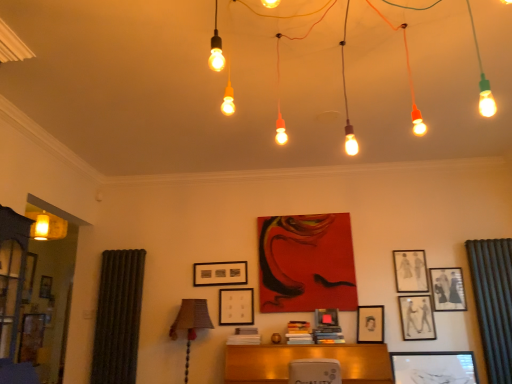
Question: From a real-world perspective, is matte black picture frame at center, the 5th picture frame when ordered from right to left, physically located above or below green textured curtain at right?

Choices:
 (A) above
 (B) below

Answer: (B)

Question: Considering the positions of matte black picture frame at center, the third picture frame from the left, and green textured curtain at right in the image, is matte black picture frame at center, the third picture frame from the left, taller or shorter than green textured curtain at right?

Choices:
 (A) short
 (B) tall

Answer: (A)

Question: Which object is positioned farthest from the matte black picture frame at center, the first picture frame when ordered from left to right?

Choices:
 (A) wooden picture frame at center, positioned as the 6th picture frame in right-to-left order
 (B) matte black picture frame at center, the third picture frame from the left
 (C) wooden desk at center
 (D) matte black picture frame at center, placed as the fourth picture frame when sorted from left to right
 (E) green textured curtain at right

Answer: (E)

Question: Which object is the closest to the matte glass lightbulbs at upper center?

Choices:
 (A) wooden desk at center
 (B) matte black picture frame at upper right, the seventh picture frame positioned from the left
 (C) green textured curtain at right
 (D) matte black picture frame at center-right, which ranks as the 2th picture frame in right-to-left order
 (E) matte black picture frame at center, placed as the fourth picture frame when sorted from left to right

Answer: (C)